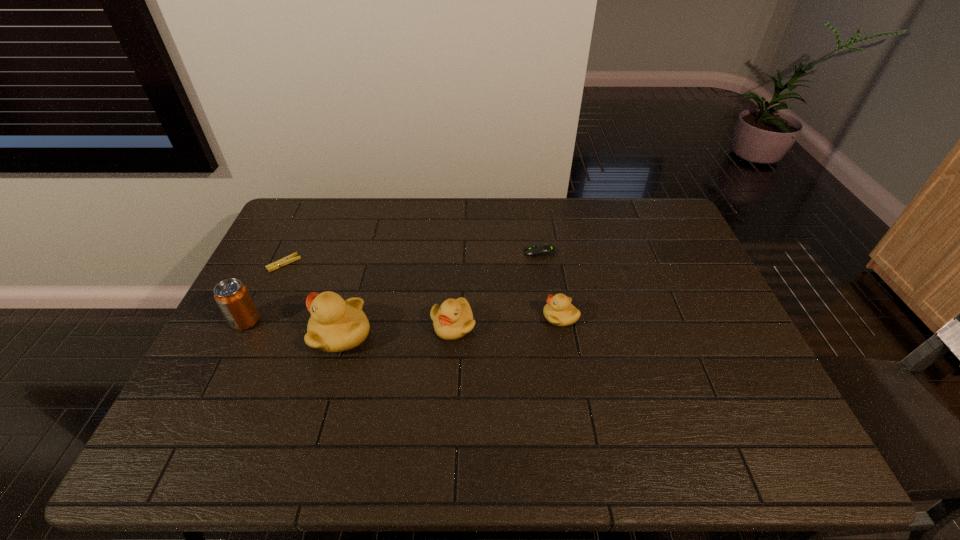
Locate an element on the screen. The image size is (960, 540). vacant space located 0.070m on the beak of the leftmost duckling is located at coordinates pyautogui.click(x=284, y=334).

You are a GUI agent. You are given a task and a screenshot of the screen. Output one action in this format:
    pyautogui.click(x=<x>, y=<y>)
    Task: Click on the blank area located on the beak of the leftmost duckling
    The image size is (960, 540).
    Given the screenshot: What is the action you would take?
    pyautogui.click(x=233, y=334)

The width and height of the screenshot is (960, 540). Find the location of `vacant region located 0.150m on the beak of the third tallest object`. vacant region located 0.150m on the beak of the third tallest object is located at coordinates point(449,392).

The height and width of the screenshot is (540, 960). I want to click on vacant space situated on the beak of the third shortest object, so [497, 317].

Locate an element on the screen. The height and width of the screenshot is (540, 960). free space located on the beak of the third shortest object is located at coordinates (416, 317).

The width and height of the screenshot is (960, 540). What are the coordinates of `vacant area situated on the beak of the third shortest object` in the screenshot? It's located at (476, 317).

I want to click on vacant region located on the right of the clothespin, so click(x=362, y=264).

Identify the location of vacant space situated 0.130m on the wheel side of the computer mouse. (484, 253).

The image size is (960, 540). I want to click on free space located on the wheel side of the computer mouse, so click(x=499, y=253).

Identify the location of vacant area situated 0.360m on the wheel side of the computer mouse. (414, 253).